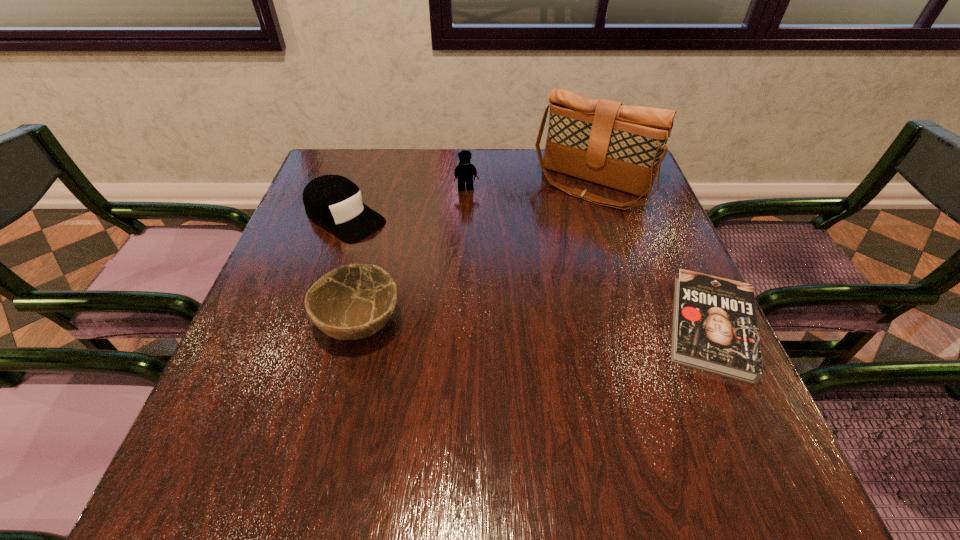
The height and width of the screenshot is (540, 960). I want to click on free space between the tallest object and the shortest object, so click(x=651, y=256).

Where is `empty space that is in between the cap and the shoulder bag`? This screenshot has height=540, width=960. empty space that is in between the cap and the shoulder bag is located at coordinates (468, 202).

Image resolution: width=960 pixels, height=540 pixels. I want to click on free space between the book and the shoulder bag, so click(x=651, y=256).

The height and width of the screenshot is (540, 960). I want to click on vacant area between the third object from left to right and the bowl, so click(414, 256).

Locate an element on the screen. This screenshot has width=960, height=540. the closest object relative to the tallest object is located at coordinates (464, 172).

Locate which object ranks in proximity to the book. Please provide its 2D coordinates. Your answer should be formatted as a tuple, i.e. [(x, y)], where the tuple contains the x and y coordinates of a point satisfying the conditions above.

[(601, 141)]

Locate an element on the screen. blank area in the image that satisfies the following two spatial constraints: 1. on the front side of the bowl; 2. on the left side of the cap is located at coordinates (309, 323).

Find the location of a particular element. vacant space that satisfies the following two spatial constraints: 1. on the back side of the bowl; 2. on the right side of the Lego is located at coordinates (392, 190).

Identify the location of free spot that satisfies the following two spatial constraints: 1. on the front side of the bowl; 2. on the left side of the shortest object. (359, 326).